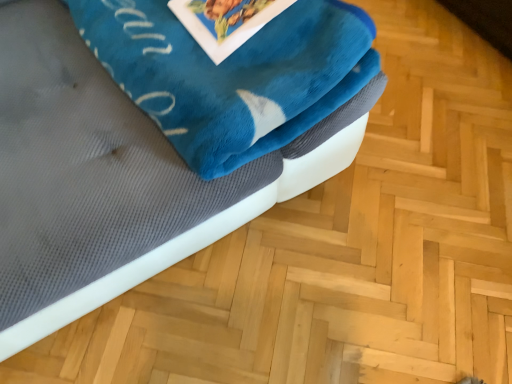
Measure the distance between velvety blue blanket at upper left and camera.

31.22 inches.

Identify the location of velvety blue blanket at upper left. Image resolution: width=512 pixels, height=384 pixels. (112, 180).

Describe the element at coordinates (112, 180) in the screenshot. I see `velvety blue blanket at upper left` at that location.

In order to face velvety blue blanket at upper left, should I rotate leftwards or rightwards?

To align with it, rotate left about 20.277°.

Image resolution: width=512 pixels, height=384 pixels. I want to click on blue plush bath towel at upper left, so click(232, 75).

What do you see at coordinates (232, 75) in the screenshot?
I see `blue plush bath towel at upper left` at bounding box center [232, 75].

The height and width of the screenshot is (384, 512). I want to click on velvety blue blanket at upper left, so click(x=112, y=180).

Between blue plush bath towel at upper left and velvety blue blanket at upper left, which one appears on the left side from the viewer's perspective?

From the viewer's perspective, velvety blue blanket at upper left appears more on the left side.

Is blue plush bath towel at upper left positioned in front of velvety blue blanket at upper left?

That is False.

Considering the positions of points (83, 19) and (6, 330), is point (83, 19) farther from camera compared to point (6, 330)?

Yes, it is.

From the image's perspective, is blue plush bath towel at upper left above or below velvety blue blanket at upper left?

blue plush bath towel at upper left is above velvety blue blanket at upper left.

From a real-world perspective, is blue plush bath towel at upper left over velvety blue blanket at upper left?

Yes.

Which of these two, blue plush bath towel at upper left or velvety blue blanket at upper left, is wider?

velvety blue blanket at upper left is wider.

Does blue plush bath towel at upper left have a greater height compared to velvety blue blanket at upper left?

In fact, blue plush bath towel at upper left may be shorter than velvety blue blanket at upper left.

Looking at the image, does blue plush bath towel at upper left seem bigger or smaller compared to velvety blue blanket at upper left?

Considering their sizes, blue plush bath towel at upper left takes up less space than velvety blue blanket at upper left.

Is blue plush bath towel at upper left positioned beyond the bounds of velvety blue blanket at upper left?

No, blue plush bath towel at upper left is inside or overlapping with velvety blue blanket at upper left.

Is there a large distance between blue plush bath towel at upper left and velvety blue blanket at upper left?

No, blue plush bath towel at upper left is not far away from velvety blue blanket at upper left.

Is velvety blue blanket at upper left at the back of blue plush bath towel at upper left?

Yes, blue plush bath towel at upper left's orientation is away from velvety blue blanket at upper left.

Find the location of a particular element. Image resolution: width=512 pixels, height=384 pixels. furniture below the blue plush bath towel at upper left (from a real-world perspective) is located at coordinates (112, 180).

Considering the relative positions of velvety blue blanket at upper left and blue plush bath towel at upper left in the image provided, is velvety blue blanket at upper left to the left of blue plush bath towel at upper left from the viewer's perspective?

Indeed, velvety blue blanket at upper left is positioned on the left side of blue plush bath towel at upper left.

Does velvety blue blanket at upper left lie behind blue plush bath towel at upper left?

No, it is not.

Between point (9, 250) and point (200, 122), which one is positioned behind?

The point (200, 122) is farther from the camera.

In the scene shown: From the image's perspective, is velvety blue blanket at upper left above or below blue plush bath towel at upper left?

velvety blue blanket at upper left is below blue plush bath towel at upper left.

From a real-world perspective, between velvety blue blanket at upper left and blue plush bath towel at upper left, who is vertically higher?

From a 3D spatial view, blue plush bath towel at upper left is above.

Does velvety blue blanket at upper left have a lesser width compared to blue plush bath towel at upper left?

No.

Who is shorter, velvety blue blanket at upper left or blue plush bath towel at upper left?

Standing shorter between the two is blue plush bath towel at upper left.

Considering the relative sizes of velvety blue blanket at upper left and blue plush bath towel at upper left in the image provided, is velvety blue blanket at upper left smaller than blue plush bath towel at upper left?

No, velvety blue blanket at upper left is not smaller than blue plush bath towel at upper left.

Is velvety blue blanket at upper left not inside blue plush bath towel at upper left?

Yes, velvety blue blanket at upper left is not within blue plush bath towel at upper left.

Is velvety blue blanket at upper left placed right next to blue plush bath towel at upper left?

No, velvety blue blanket at upper left is not making contact with blue plush bath towel at upper left.

Is velvety blue blanket at upper left aimed at blue plush bath towel at upper left?

Yes, velvety blue blanket at upper left is facing blue plush bath towel at upper left.

How far apart are velvety blue blanket at upper left and blue plush bath towel at upper left?

velvety blue blanket at upper left and blue plush bath towel at upper left are 15.36 centimeters apart.

Where is `bath towel lying on the right of velvety blue blanket at upper left`? bath towel lying on the right of velvety blue blanket at upper left is located at coordinates (232, 75).

Locate an element on the screen. The height and width of the screenshot is (384, 512). bath towel above the velvety blue blanket at upper left (from the image's perspective) is located at coordinates (232, 75).

Locate an element on the screen. furniture in front of the blue plush bath towel at upper left is located at coordinates (112, 180).